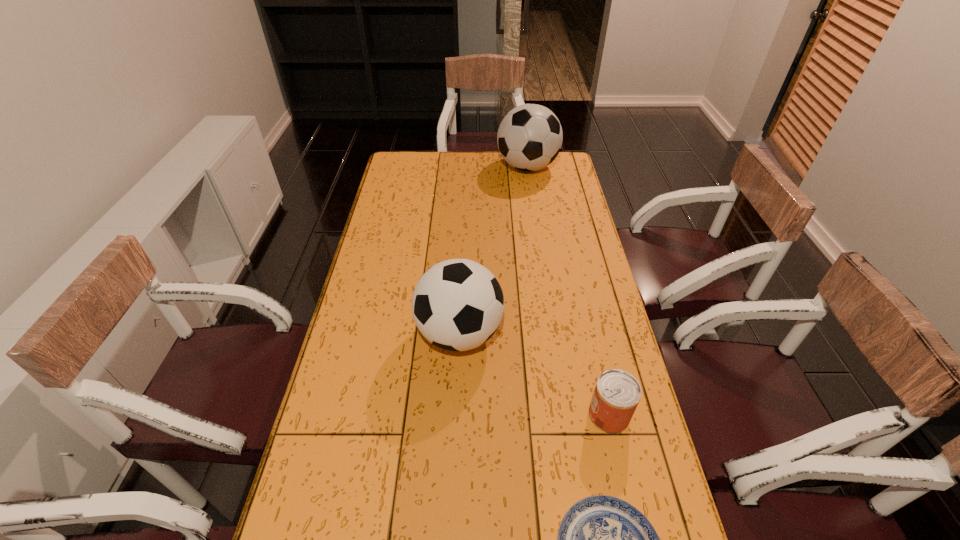
You are a GUI agent. You are given a task and a screenshot of the screen. Output one action in this format:
    pyautogui.click(x=<x>, y=<y>)
    Task: Click on the farthest object
    The height and width of the screenshot is (540, 960).
    Given the screenshot: What is the action you would take?
    pyautogui.click(x=529, y=138)

Where is `the right soccer ball`? Image resolution: width=960 pixels, height=540 pixels. the right soccer ball is located at coordinates (529, 138).

Identify the location of the nearer soccer ball. (458, 304).

You are a GUI agent. You are given a task and a screenshot of the screen. Output one action in this format:
    pyautogui.click(x=<x>, y=<y>)
    Task: Click on the third nearest object
    This screenshot has width=960, height=540.
    Given the screenshot: What is the action you would take?
    pyautogui.click(x=458, y=304)

Locate an element on the screen. the third farthest object is located at coordinates (617, 393).

You are a GUI agent. You are given a task and a screenshot of the screen. Output one action in this format:
    pyautogui.click(x=<x>, y=<y>)
    Task: Click on the can
    This screenshot has height=540, width=960.
    Given the screenshot: What is the action you would take?
    pyautogui.click(x=617, y=393)

At what (x,y) coordinates should I click in order to perform the action: click on vacant space located 0.200m on the front of the farther soccer ball. Please return your answer as a coordinate pair (x, y). Looking at the image, I should click on [x=534, y=210].

Locate an element on the screen. The height and width of the screenshot is (540, 960). blank space located on the front of the nearer soccer ball is located at coordinates (456, 408).

Locate an element on the screen. free space located 0.140m on the left of the can is located at coordinates (536, 415).

Locate an element on the screen. The image size is (960, 540). object that is at the far edge is located at coordinates coord(529,138).